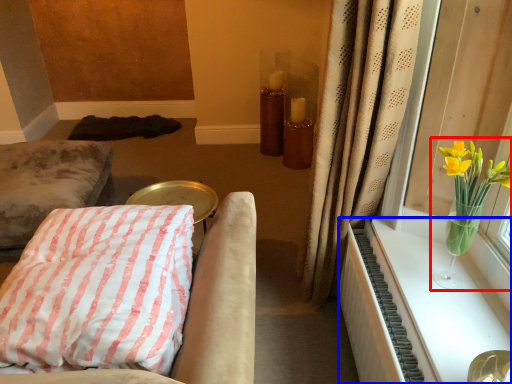
Question: Among these objects, which one is nearest to the camera, floral arrangement (highlighted by a red box) or radiator (highlighted by a blue box)?

Choices:
 (A) floral arrangement
 (B) radiator

Answer: (B)